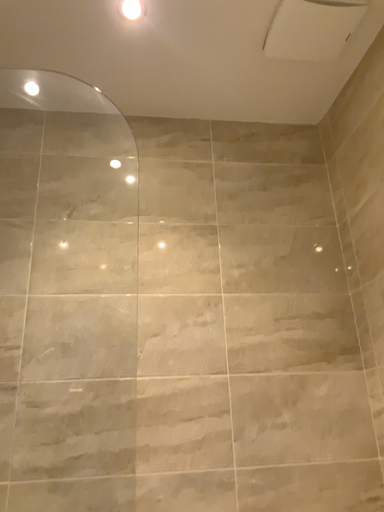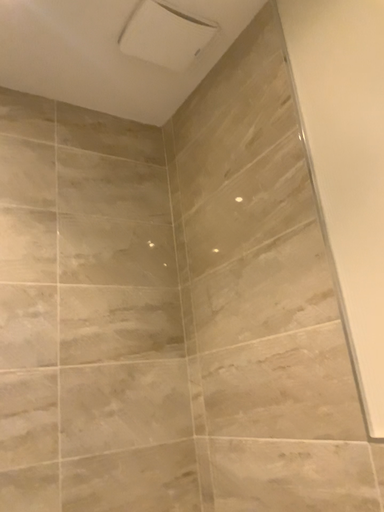
Question: Which way did the camera rotate in the video?

Choices:
 (A) rotated left
 (B) rotated right

Answer: (B)